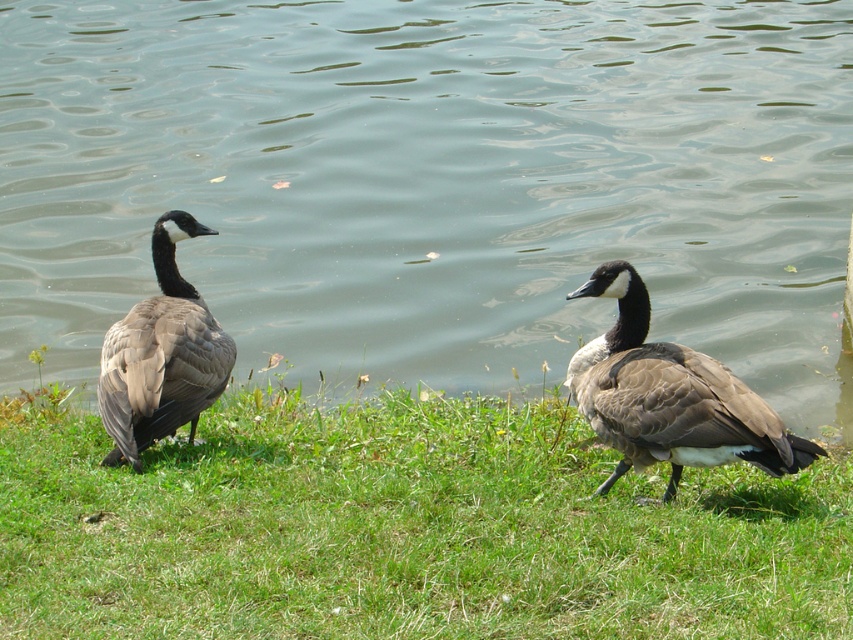
Question: Does green grass at lower left have a lesser width compared to brown feathered duck at left?

Choices:
 (A) yes
 (B) no

Answer: (B)

Question: Considering the real-world distances, which object is farthest from the brown feathered duck at left?

Choices:
 (A) brown matte duck at right
 (B) green grass at lower left
 (C) greenish water at center

Answer: (C)

Question: Which object is closer to the camera taking this photo?

Choices:
 (A) greenish water at center
 (B) brown matte duck at right
 (C) green grass at lower left
 (D) brown feathered duck at left

Answer: (C)

Question: Can you confirm if greenish water at center is positioned to the left of green grass at lower left?

Choices:
 (A) no
 (B) yes

Answer: (B)

Question: Does greenish water at center have a lesser width compared to green grass at lower left?

Choices:
 (A) yes
 (B) no

Answer: (B)

Question: Which point is farther to the camera?

Choices:
 (A) brown feathered duck at left
 (B) green grass at lower left
 (C) greenish water at center
 (D) brown matte duck at right

Answer: (A)